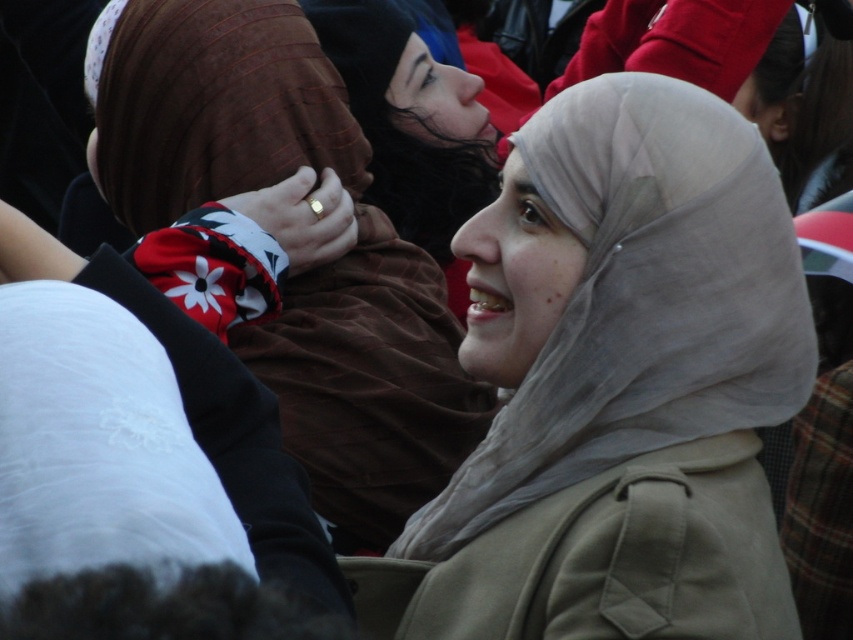
Question: Is light beige sheer at center above matte brown scarf at center?

Choices:
 (A) yes
 (B) no

Answer: (B)

Question: Which point is closer to the camera?

Choices:
 (A) light beige sheer at center
 (B) matte brown scarf at center

Answer: (A)

Question: Can you confirm if light beige sheer at center is positioned above matte brown scarf at center?

Choices:
 (A) yes
 (B) no

Answer: (B)

Question: Is light beige sheer at center to the right of matte brown scarf at center from the viewer's perspective?

Choices:
 (A) no
 (B) yes

Answer: (B)